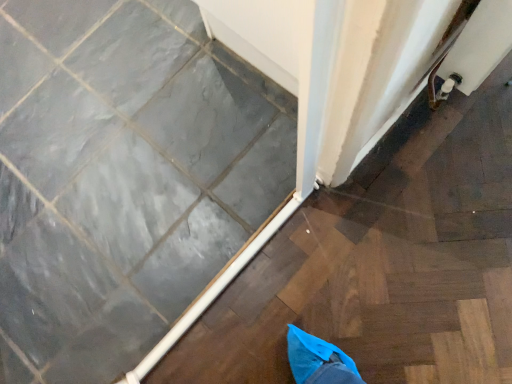
Question: From a real-world perspective, is white glossy door at upper center physically located above or below slate gray ceramic tile at lower left?

Choices:
 (A) below
 (B) above

Answer: (A)

Question: Considering the positions of white glossy door at upper center and slate gray ceramic tile at lower left in the image, is white glossy door at upper center bigger or smaller than slate gray ceramic tile at lower left?

Choices:
 (A) big
 (B) small

Answer: (B)

Question: Considering the positions of white glossy door at upper center and slate gray ceramic tile at lower left in the image, is white glossy door at upper center wider or thinner than slate gray ceramic tile at lower left?

Choices:
 (A) thin
 (B) wide

Answer: (A)

Question: Considering the positions of slate gray ceramic tile at lower left and white glossy door at upper center in the image, is slate gray ceramic tile at lower left taller or shorter than white glossy door at upper center?

Choices:
 (A) short
 (B) tall

Answer: (B)

Question: From the image's perspective, relative to white glossy door at upper center, is slate gray ceramic tile at lower left above or below?

Choices:
 (A) below
 (B) above

Answer: (B)

Question: Considering their positions, is slate gray ceramic tile at lower left located in front of or behind white glossy door at upper center?

Choices:
 (A) front
 (B) behind

Answer: (B)

Question: Considering the positions of slate gray ceramic tile at lower left and white glossy door at upper center in the image, is slate gray ceramic tile at lower left wider or thinner than white glossy door at upper center?

Choices:
 (A) thin
 (B) wide

Answer: (B)